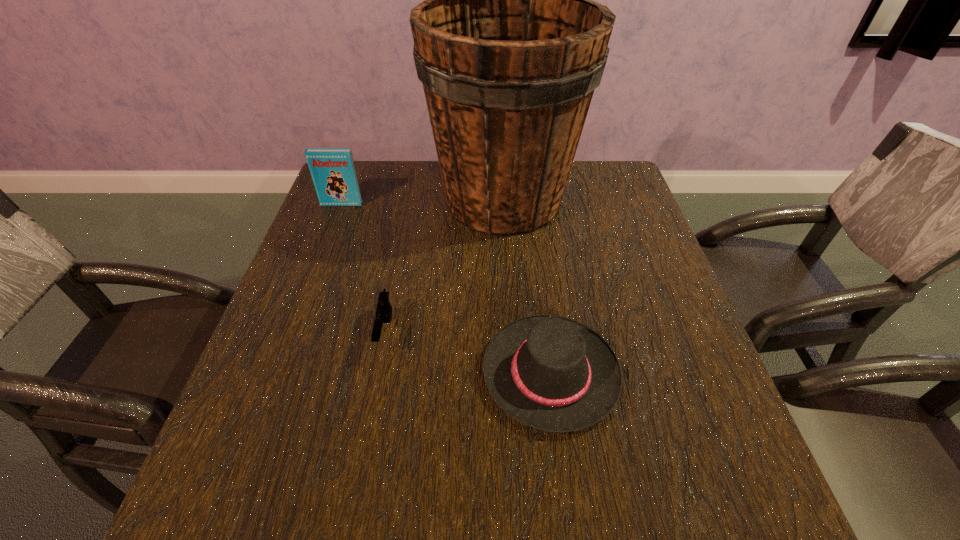
In order to click on bucket that is at the far edge in this screenshot , I will do `click(509, 45)`.

Locate an element on the screen. book located in the far edge section of the desktop is located at coordinates (333, 172).

Where is `object present at the left edge`? This screenshot has height=540, width=960. object present at the left edge is located at coordinates (333, 172).

Identify the location of object located at the right edge. (509, 45).

Where is `object situated at the far left corner`? Image resolution: width=960 pixels, height=540 pixels. object situated at the far left corner is located at coordinates (333, 172).

In order to click on object present at the far right corner in this screenshot , I will do `click(509, 45)`.

Image resolution: width=960 pixels, height=540 pixels. Find the location of `vacant space at the left edge of the desktop`. vacant space at the left edge of the desktop is located at coordinates (377, 214).

Find the location of a particular element. This screenshot has height=540, width=960. free space at the right edge is located at coordinates (643, 218).

Locate an element on the screen. vacant space at the far left corner of the desktop is located at coordinates [373, 161].

This screenshot has width=960, height=540. What are the coordinates of `vacant space at the near right corner of the desktop` in the screenshot? It's located at (710, 524).